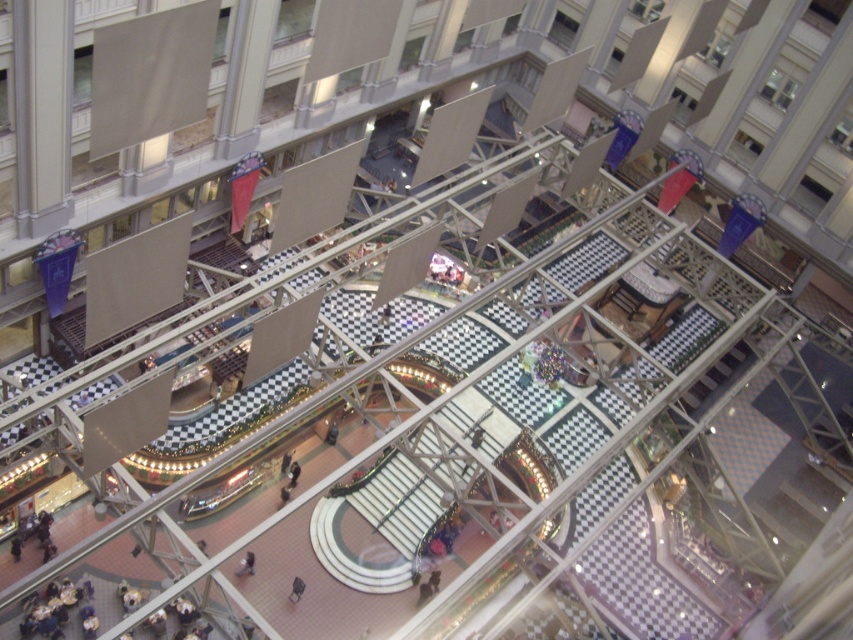
Can you confirm if smooth beige coat at center is shorter than dark gray fabric jacket at center?

Indeed, smooth beige coat at center has a lesser height compared to dark gray fabric jacket at center.

Between point (247, 572) and point (289, 484), which one is positioned in front?

Point (247, 572) is in front.

You are a GUI agent. You are given a task and a screenshot of the screen. Output one action in this format:
    pyautogui.click(x=<x>, y=<y>)
    Task: Click on the smooth beige coat at center
    The height and width of the screenshot is (640, 853).
    Given the screenshot: What is the action you would take?
    pyautogui.click(x=247, y=564)